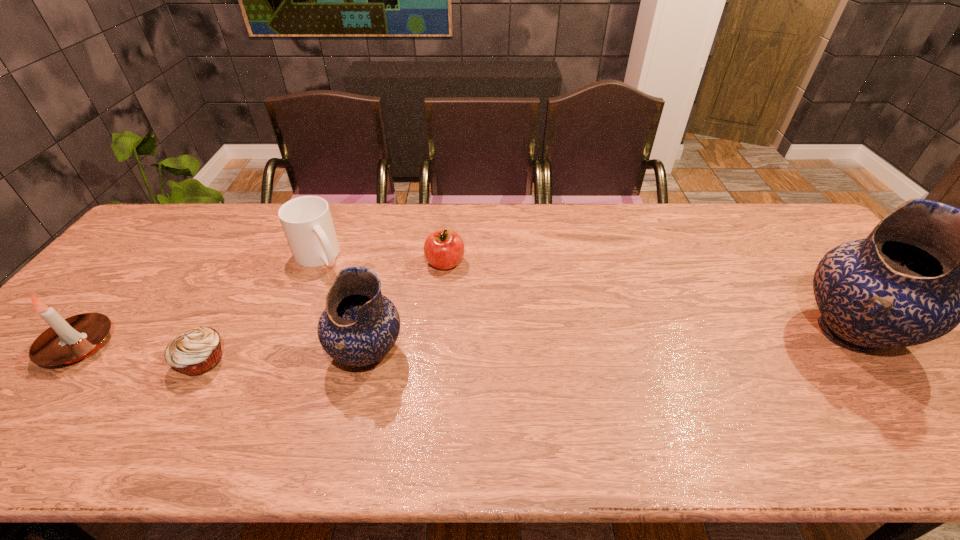
Locate an element on the screen. The image size is (960, 540). vacant point located between the left pottery and the shortest object is located at coordinates (285, 357).

In order to click on vacant area that lies between the candle and the second tallest object in this screenshot , I will do `click(223, 350)`.

This screenshot has height=540, width=960. What are the coordinates of `free space that is in between the mug and the tallest object` in the screenshot? It's located at (584, 295).

This screenshot has height=540, width=960. Identify the location of the second closest object to the shortest object. (307, 223).

You are a GUI agent. You are given a task and a screenshot of the screen. Output one action in this format:
    pyautogui.click(x=<x>, y=<y>)
    Task: Click on the object that stands as the fourth closest to the left pottery
    Image resolution: width=960 pixels, height=540 pixels.
    Given the screenshot: What is the action you would take?
    69,340

Locate an element on the screen. The width and height of the screenshot is (960, 540). free point that satisfies the following two spatial constraints: 1. on the back side of the fourth object from right to left; 2. on the left side of the second object from left to right is located at coordinates (260, 257).

This screenshot has height=540, width=960. Find the location of `vacant region that satisfies the following two spatial constraints: 1. on the back side of the candle; 2. on the right side of the apple`. vacant region that satisfies the following two spatial constraints: 1. on the back side of the candle; 2. on the right side of the apple is located at coordinates pos(148,263).

This screenshot has height=540, width=960. I want to click on vacant position in the image that satisfies the following two spatial constraints: 1. on the front side of the shorter pottery; 2. on the right side of the fourth object from right to left, so click(x=279, y=354).

This screenshot has width=960, height=540. I want to click on free space that satisfies the following two spatial constraints: 1. on the front side of the apple; 2. on the right side of the tallest object, so click(439, 332).